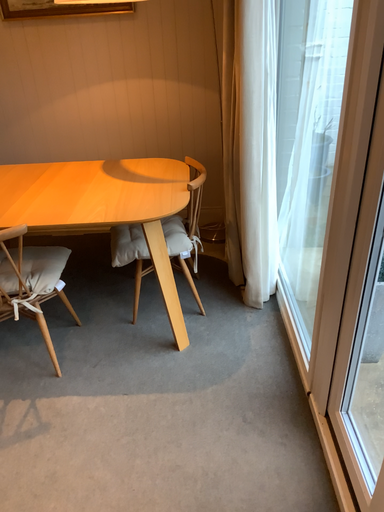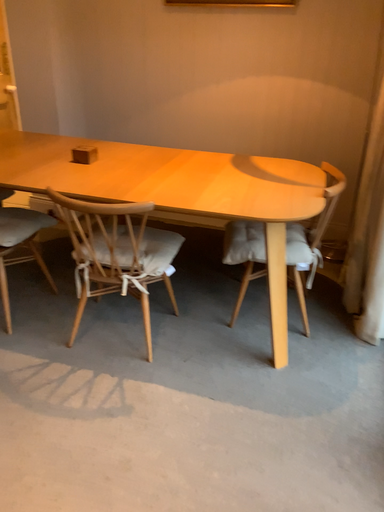
Question: Which way did the camera rotate in the video?

Choices:
 (A) rotated right
 (B) rotated left

Answer: (B)